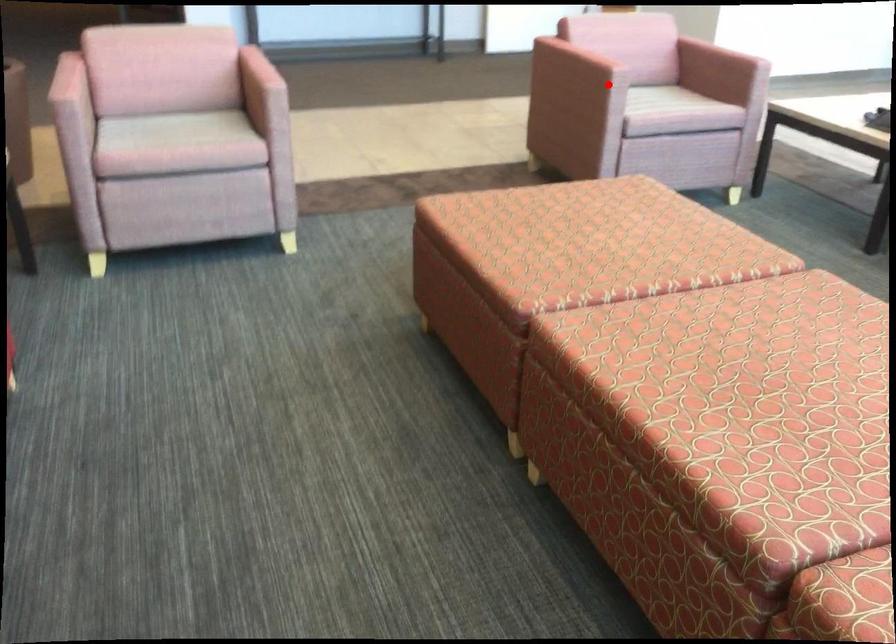
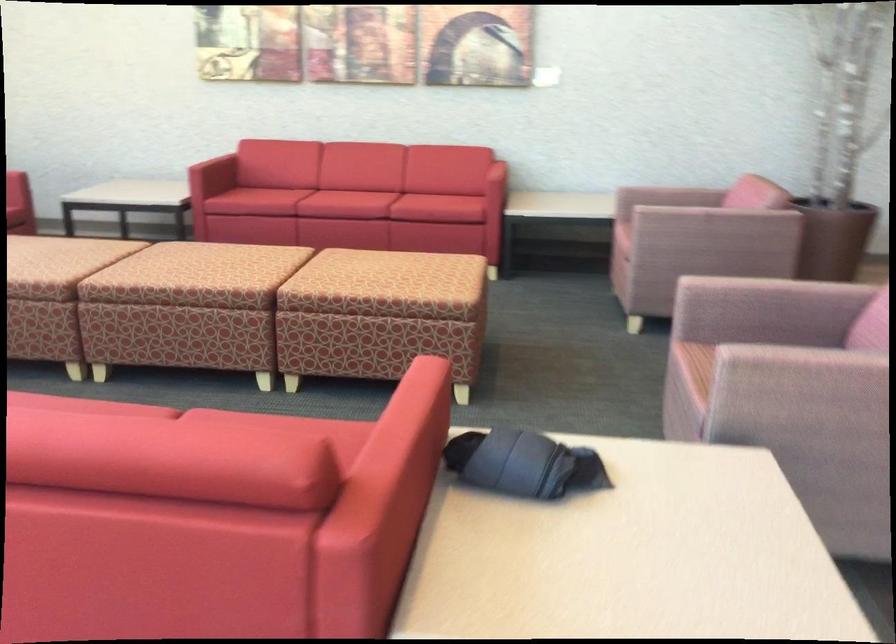
Question: A red point is marked in image1. In image2, is the corresponding 3D point closer to the camera or farther? Reply with the corresponding letter.

Choices:
 (A) The corresponding 3D point is closer.
 (B) The corresponding 3D point is farther.

Answer: (A)